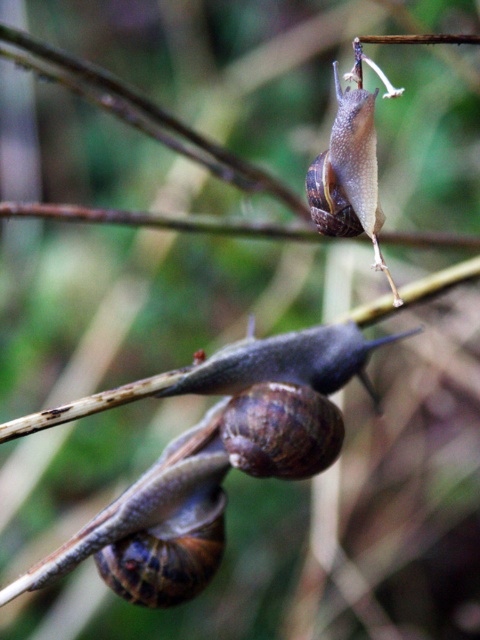
Question: Among these objects, which one is nearest to the camera?

Choices:
 (A) shiny brown snail at upper center
 (B) brown textured snail at center

Answer: (B)

Question: Is brown textured snail at center closer to camera compared to shiny brown snail at upper center?

Choices:
 (A) no
 (B) yes

Answer: (B)

Question: Does brown textured snail at center appear over shiny brown snail at upper center?

Choices:
 (A) no
 (B) yes

Answer: (A)

Question: From the image, what is the correct spatial relationship of brown textured snail at center in relation to shiny brown snail at upper center?

Choices:
 (A) left
 (B) right

Answer: (A)